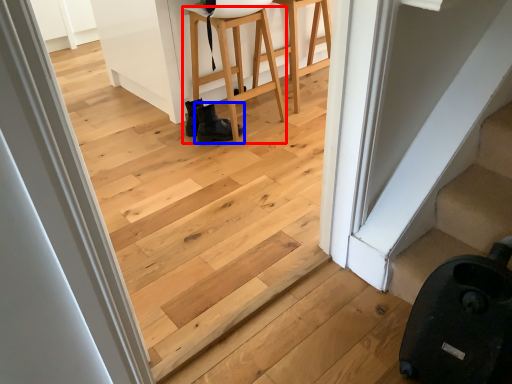
Question: Which object is further to the camera taking this photo, furniture (highlighted by a red box) or footwear (highlighted by a blue box)?

Choices:
 (A) furniture
 (B) footwear

Answer: (B)